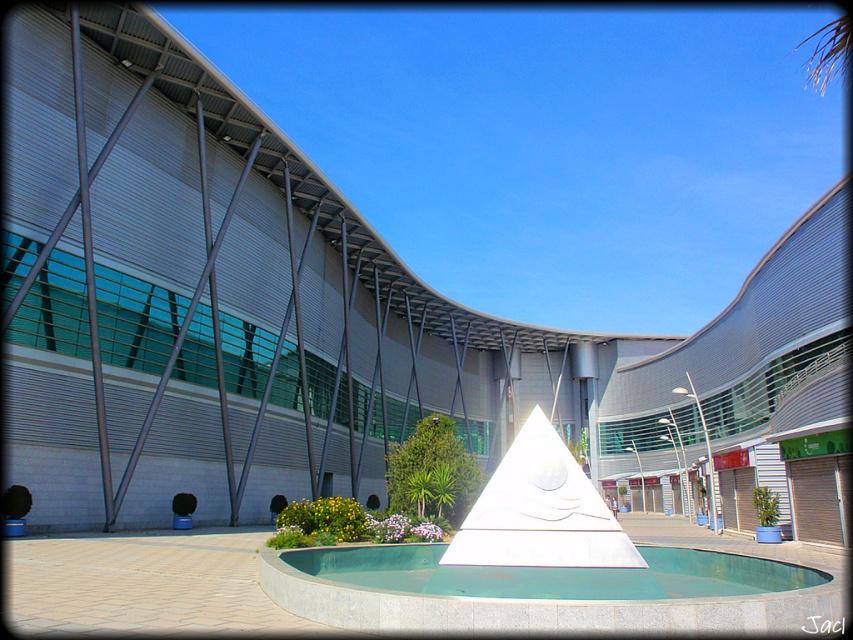
Question: Does white marble fountain at center come in front of green polished stone pool at center?

Choices:
 (A) no
 (B) yes

Answer: (B)

Question: Among these objects, which one is nearest to the camera?

Choices:
 (A) green polished stone pool at center
 (B) white marble fountain at center

Answer: (B)

Question: Does white marble fountain at center appear under green polished stone pool at center?

Choices:
 (A) yes
 (B) no

Answer: (B)

Question: Can you confirm if white marble fountain at center is wider than green polished stone pool at center?

Choices:
 (A) no
 (B) yes

Answer: (B)